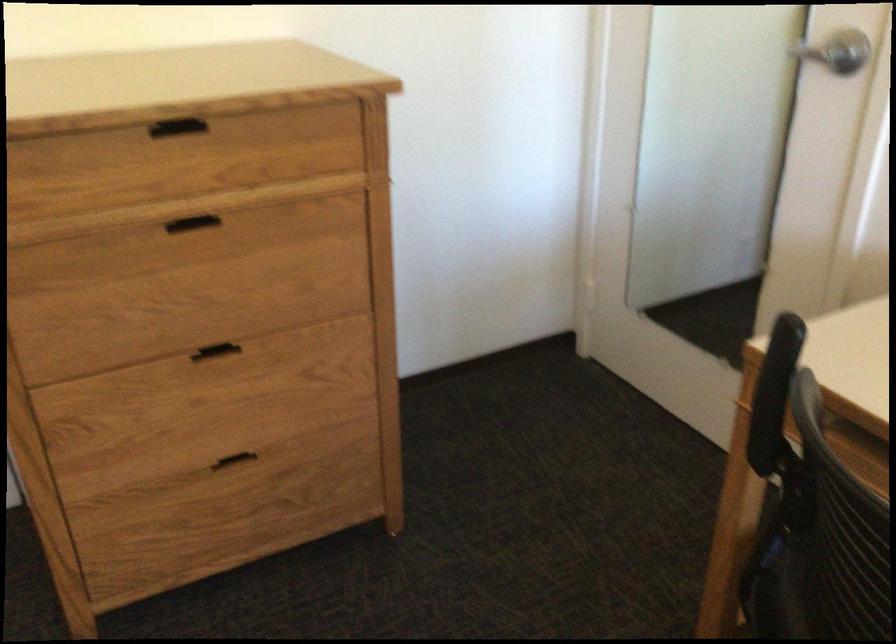
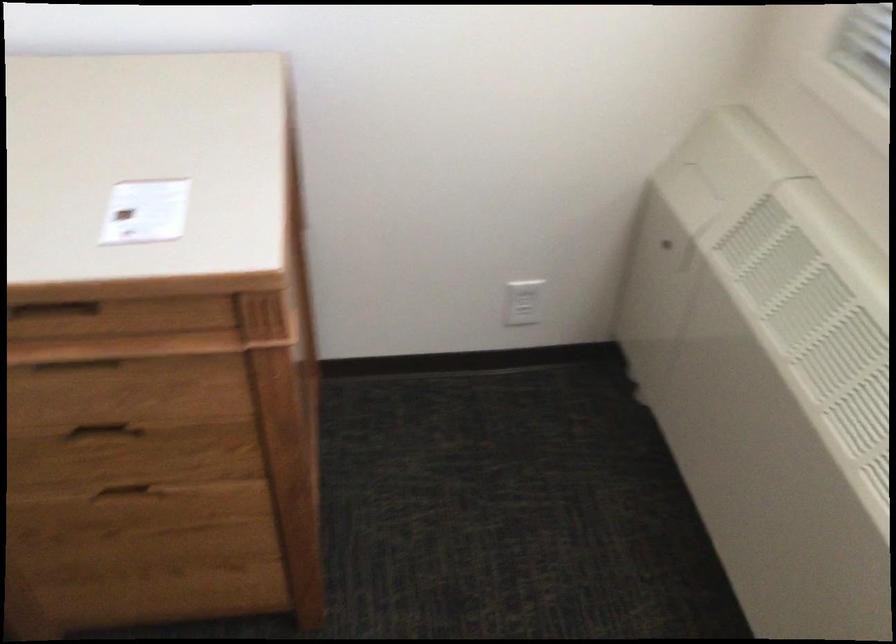
The images are taken continuously from a first-person perspective. In which direction is your viewpoint rotating?

The camera's rotation is toward right-down.